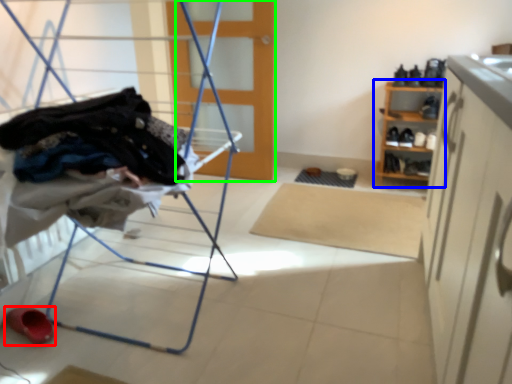
Question: Which object is the closest to the footwear (highlighted by a red box)? Choose among these: shelf (highlighted by a blue box) or door (highlighted by a green box).

Choices:
 (A) shelf
 (B) door

Answer: (B)